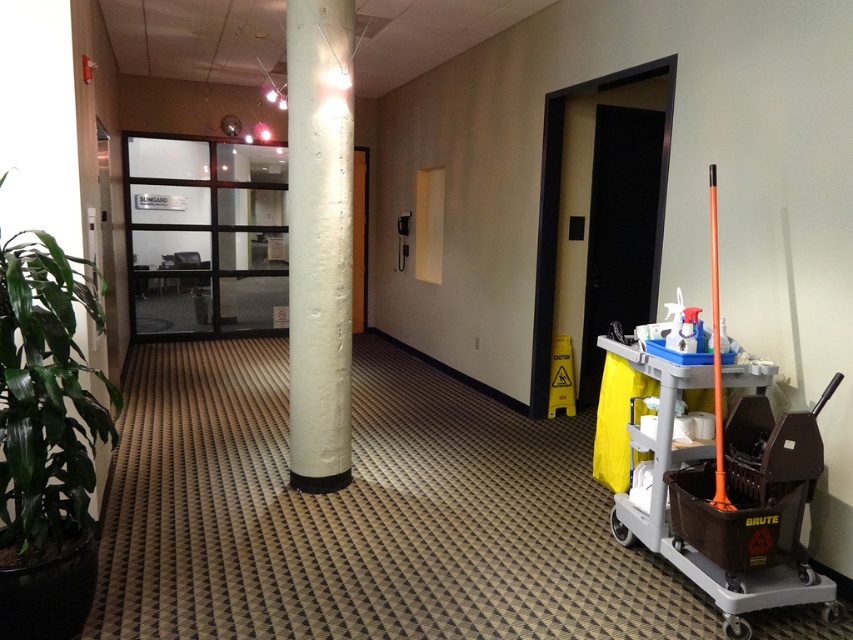
Question: Which is farther from the green leafy plant at left?

Choices:
 (A) white textured column at center
 (B) matte gray trolley at right

Answer: (B)

Question: Can you confirm if white textured column at center is wider than orange plastic pole at right?

Choices:
 (A) no
 (B) yes

Answer: (B)

Question: Which object appears closest to the camera in this image?

Choices:
 (A) green leafy plant at left
 (B) matte gray trolley at right

Answer: (A)

Question: Among these points, which one is nearest to the camera?

Choices:
 (A) (54, 337)
 (B) (653, 442)
 (C) (312, 336)

Answer: (A)

Question: Does matte gray trolley at right have a lesser width compared to orange plastic pole at right?

Choices:
 (A) yes
 (B) no

Answer: (B)

Question: Does matte gray trolley at right appear over orange plastic pole at right?

Choices:
 (A) yes
 (B) no

Answer: (B)